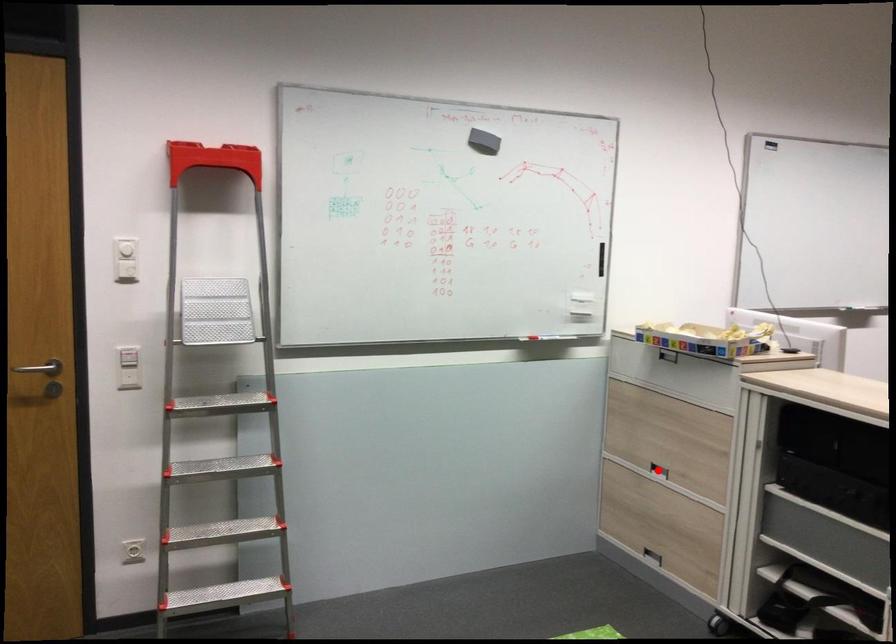
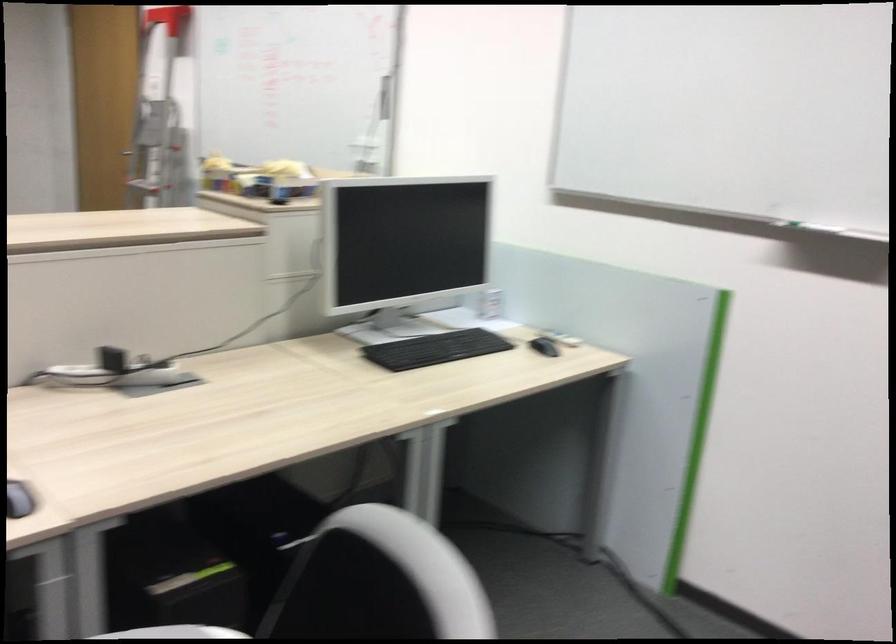
Question: I am providing you with two images of the same scene from different viewpoints. A red point is marked on the first image. At the location where the point appears in image 1, is it still visible in image 2?

Choices:
 (A) Yes
 (B) No

Answer: (B)